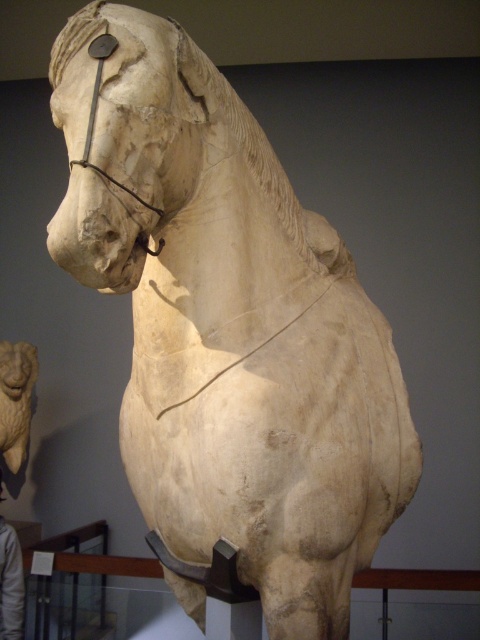
Is white marble lion at upper left smaller than light brown leather jacket at lower left?

Yes, white marble lion at upper left is smaller than light brown leather jacket at lower left.

Is white marble lion at upper left to the left of light brown leather jacket at lower left from the viewer's perspective?

Correct, you'll find white marble lion at upper left to the left of light brown leather jacket at lower left.

The height and width of the screenshot is (640, 480). What do you see at coordinates (15, 400) in the screenshot? I see `white marble lion at upper left` at bounding box center [15, 400].

Find the location of a particular element. The height and width of the screenshot is (640, 480). white marble lion at upper left is located at coordinates (15, 400).